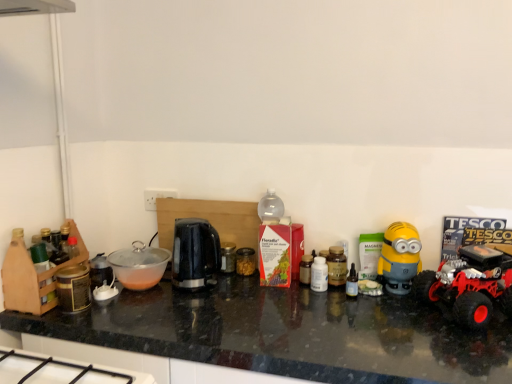
Question: Does translucent plastic bottle at center, placed as the fourth bottle when sorted from left to right, have a greater width compared to transparent plastic bowl at center?

Choices:
 (A) yes
 (B) no

Answer: (B)

Question: Is translucent plastic bottle at center, placed as the fourth bottle when sorted from left to right, next to transparent plastic bowl at center and touching it?

Choices:
 (A) yes
 (B) no

Answer: (B)

Question: Is translucent plastic bottle at center, which is counted as the 1th bottle, starting from the right, further to the viewer compared to transparent plastic bowl at center?

Choices:
 (A) yes
 (B) no

Answer: (B)

Question: Considering the relative sizes of translucent plastic bottle at center, which is counted as the 1th bottle, starting from the right, and transparent plastic bowl at center in the image provided, is translucent plastic bottle at center, which is counted as the 1th bottle, starting from the right, bigger than transparent plastic bowl at center?

Choices:
 (A) yes
 (B) no

Answer: (B)

Question: Does translucent plastic bottle at center, placed as the fourth bottle when sorted from left to right, have a smaller size compared to transparent plastic bowl at center?

Choices:
 (A) no
 (B) yes

Answer: (B)

Question: From a real-world perspective, is translucent plastic bottle at center, which is counted as the 1th bottle, starting from the right, beneath transparent plastic bowl at center?

Choices:
 (A) no
 (B) yes

Answer: (B)

Question: Can you confirm if translucent plastic jar at center, acting as the 2th toy starting from the right, is thinner than white plastic bottle at center, marked as the second bottle in a left-to-right arrangement?

Choices:
 (A) no
 (B) yes

Answer: (A)

Question: From the image's perspective, is translucent plastic jar at center, positioned as the 1th toy in back-to-front order, below white plastic bottle at center, marked as the second bottle in a left-to-right arrangement?

Choices:
 (A) no
 (B) yes

Answer: (A)

Question: Is translucent plastic jar at center, positioned as the 1th toy in back-to-front order, bigger than white plastic bottle at center, marked as the second bottle in a left-to-right arrangement?

Choices:
 (A) yes
 (B) no

Answer: (B)

Question: From a real-world perspective, is translucent plastic jar at center, the 2th toy viewed from the front, located higher than white plastic bottle at center, marked as the second bottle in a left-to-right arrangement?

Choices:
 (A) yes
 (B) no

Answer: (B)

Question: Considering the relative positions of translucent plastic jar at center, acting as the 2th toy starting from the right, and white plastic bottle at center, marked as the third bottle in a right-to-left arrangement, in the image provided, is translucent plastic jar at center, acting as the 2th toy starting from the right, in front of white plastic bottle at center, marked as the third bottle in a right-to-left arrangement,?

Choices:
 (A) yes
 (B) no

Answer: (B)

Question: Does translucent plastic jar at center, the 1th toy in the left-to-right sequence, contain white plastic bottle at center, marked as the second bottle in a left-to-right arrangement?

Choices:
 (A) yes
 (B) no

Answer: (B)

Question: Is black granite countertop at center at the right side of translucent plastic bottle at center, the fourth bottle positioned from the right?

Choices:
 (A) yes
 (B) no

Answer: (B)